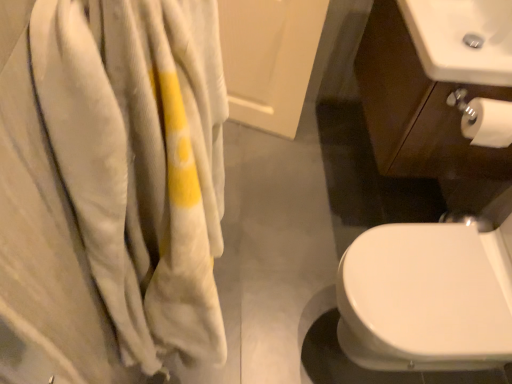
Locate an element on the screen. soft white towel at left is located at coordinates (110, 190).

Describe the element at coordinates (487, 122) in the screenshot. I see `white matte toilet paper at lower right` at that location.

Describe the element at coordinates (428, 298) in the screenshot. I see `white glossy sink at lower right, which appears as the 2th sink when viewed from the back` at that location.

Where is `white glossy sink at upper right, which is counted as the second sink, starting from the bottom`? This screenshot has width=512, height=384. white glossy sink at upper right, which is counted as the second sink, starting from the bottom is located at coordinates (462, 39).

Between white glossy sink at lower right, the 1th sink when ordered from front to back, and white matte toilet paper at lower right, which one has larger width?

white glossy sink at lower right, the 1th sink when ordered from front to back, is wider.

Does point (437, 144) lie in front of point (487, 119)?

No.

Is white glossy sink at lower right, the 1th sink when ordered from front to back, facing towards white matte toilet paper at lower right?

No, white glossy sink at lower right, the 1th sink when ordered from front to back, is not facing towards white matte toilet paper at lower right.

Considering the relative sizes of white glossy sink at lower right, the 1th sink from the bottom, and white matte toilet paper at lower right in the image provided, is white glossy sink at lower right, the 1th sink from the bottom, taller than white matte toilet paper at lower right?

Indeed, white glossy sink at lower right, the 1th sink from the bottom, has a greater height compared to white matte toilet paper at lower right.

Considering the points (59, 136) and (390, 111), which point is behind, point (59, 136) or point (390, 111)?

The point (390, 111) is more distant.

Does soft white towel at left turn towards white glossy sink at lower right, the 2th sink when ordered from top to bottom?

Yes, soft white towel at left is turned towards white glossy sink at lower right, the 2th sink when ordered from top to bottom.

From a real-world perspective, which is physically below, soft white towel at left or white glossy sink at lower right, which appears as the 2th sink when viewed from the back?

white glossy sink at lower right, which appears as the 2th sink when viewed from the back.

Considering the relative positions of white glossy sink at upper right, the first sink positioned from the back, and soft white towel at left in the image provided, is white glossy sink at upper right, the first sink positioned from the back, behind soft white towel at left?

Yes, it is.

Which is more to the left, white glossy sink at upper right, which is counted as the first sink, starting from the top, or soft white towel at left?

Positioned to the left is soft white towel at left.

Can you confirm if white glossy sink at upper right, the first sink positioned from the back, is smaller than soft white towel at left?

Yes, white glossy sink at upper right, the first sink positioned from the back, is smaller than soft white towel at left.

Are white glossy sink at upper right, marked as the second sink in a front-to-back arrangement, and soft white towel at left located far from each other?

That's not correct — white glossy sink at upper right, marked as the second sink in a front-to-back arrangement, is a little close to soft white towel at left.

Is white glossy sink at upper right, the first sink positioned from the back, inside or outside of white matte toilet paper at lower right?

white glossy sink at upper right, the first sink positioned from the back, is not inside white matte toilet paper at lower right, it's outside.

Is white glossy sink at upper right, the first sink positioned from the back, not near white matte toilet paper at lower right?

That's not correct — white glossy sink at upper right, the first sink positioned from the back, is a little close to white matte toilet paper at lower right.

Which object is more forward, white glossy sink at upper right, marked as the second sink in a front-to-back arrangement, or white matte toilet paper at lower right?

white glossy sink at upper right, marked as the second sink in a front-to-back arrangement.

Is soft white towel at left taller than white glossy sink at upper right, the first sink positioned from the back?

Indeed, soft white towel at left has a greater height compared to white glossy sink at upper right, the first sink positioned from the back.

Is soft white towel at left looking in the opposite direction of white glossy sink at upper right, which is counted as the first sink, starting from the top?

No.

Looking at their sizes, would you say soft white towel at left is wider or thinner than white glossy sink at upper right, marked as the second sink in a front-to-back arrangement?

Clearly, soft white towel at left has less width compared to white glossy sink at upper right, marked as the second sink in a front-to-back arrangement.

Which sink is the 2nd one when counting from the right side of the soft white towel at left? Please provide its 2D coordinates.

[(462, 39)]

Is white matte toilet paper at lower right directly adjacent to white glossy sink at upper right, which is counted as the first sink, starting from the top?

There is a gap between white matte toilet paper at lower right and white glossy sink at upper right, which is counted as the first sink, starting from the top.

Considering the relative positions of white matte toilet paper at lower right and white glossy sink at upper right, which is counted as the second sink, starting from the bottom, in the image provided, is white matte toilet paper at lower right in front of white glossy sink at upper right, which is counted as the second sink, starting from the bottom,?

That is False.

Do you think white matte toilet paper at lower right is within white glossy sink at upper right, which is counted as the first sink, starting from the top, or outside of it?

white matte toilet paper at lower right is not enclosed by white glossy sink at upper right, which is counted as the first sink, starting from the top.

Is white glossy sink at upper right, which is counted as the second sink, starting from the bottom, inside the boundaries of white glossy sink at lower right, the 2th sink when ordered from top to bottom, or outside?

The correct answer is: outside.

Does white glossy sink at upper right, the first sink positioned from the back, come behind white glossy sink at lower right, which appears as the 2th sink when viewed from the back?

Yes, the depth of white glossy sink at upper right, the first sink positioned from the back, is greater than that of white glossy sink at lower right, which appears as the 2th sink when viewed from the back.

Which is more distant, (434, 19) or (368, 276)?

The point (434, 19) is farther.

Is white glossy sink at upper right, marked as the second sink in a front-to-back arrangement, not near white glossy sink at lower right, the 1th sink from the bottom?

No, white glossy sink at upper right, marked as the second sink in a front-to-back arrangement, is not far from white glossy sink at lower right, the 1th sink from the bottom.

Locate an element on the screen. This screenshot has height=384, width=512. sink below the white matte toilet paper at lower right (from the image's perspective) is located at coordinates (428, 298).

Identify the location of sink that is the 1st one when counting backward from the soft white towel at left. (428, 298).

Estimate the real-world distances between objects in this image. Which object is further from white glossy sink at upper right, marked as the second sink in a front-to-back arrangement, white glossy sink at lower right, the 1th sink from the bottom, or white matte toilet paper at lower right?

white matte toilet paper at lower right is further to white glossy sink at upper right, marked as the second sink in a front-to-back arrangement.

When comparing their distances from white matte toilet paper at lower right, does soft white towel at left or white glossy sink at upper right, which is counted as the first sink, starting from the top, seem closer?

Among the two, white glossy sink at upper right, which is counted as the first sink, starting from the top, is located nearer to white matte toilet paper at lower right.

Which object lies further to the anchor point white glossy sink at upper right, which is counted as the second sink, starting from the bottom, white matte toilet paper at lower right or white glossy sink at lower right, which appears as the 2th sink when viewed from the back?

white matte toilet paper at lower right is positioned further to the anchor white glossy sink at upper right, which is counted as the second sink, starting from the bottom.

When comparing their distances from white glossy sink at lower right, the 1th sink from the bottom, does white glossy sink at upper right, marked as the second sink in a front-to-back arrangement, or white matte toilet paper at lower right seem further?

white matte toilet paper at lower right lies further to white glossy sink at lower right, the 1th sink from the bottom, than the other object.

Considering their positions, is white glossy sink at lower right, which appears as the 2th sink when viewed from the back, positioned further to soft white towel at left than white glossy sink at upper right, marked as the second sink in a front-to-back arrangement?

white glossy sink at upper right, marked as the second sink in a front-to-back arrangement.

Which object lies nearer to the anchor point white matte toilet paper at lower right, white glossy sink at lower right, the 1th sink from the bottom, or white glossy sink at upper right, marked as the second sink in a front-to-back arrangement?

white glossy sink at upper right, marked as the second sink in a front-to-back arrangement, lies closer to white matte toilet paper at lower right than the other object.

Considering their positions, is soft white towel at left positioned closer to white glossy sink at upper right, which is counted as the first sink, starting from the top, than white glossy sink at lower right, the 1th sink from the bottom?

Based on the image, white glossy sink at lower right, the 1th sink from the bottom, appears to be nearer to white glossy sink at upper right, which is counted as the first sink, starting from the top.

Considering their positions, is white matte toilet paper at lower right positioned further to soft white towel at left than white glossy sink at lower right, the 2th sink when ordered from top to bottom?

white matte toilet paper at lower right is positioned further to the anchor soft white towel at left.

Locate an element on the screen. The image size is (512, 384). toilet paper between white glossy sink at upper right, which is counted as the first sink, starting from the top, and white glossy sink at lower right, the 1th sink when ordered from front to back, in the vertical direction is located at coordinates (487, 122).

Locate an element on the screen. The image size is (512, 384). sink situated between soft white towel at left and white glossy sink at upper right, the first sink positioned from the back, from left to right is located at coordinates (428, 298).